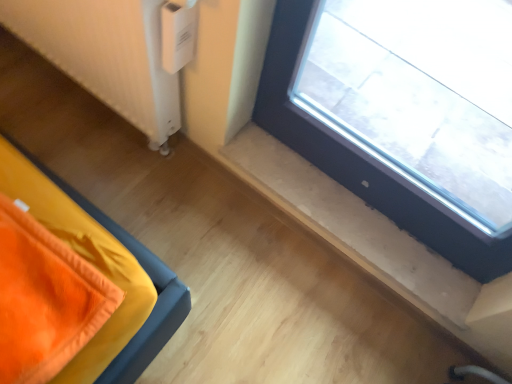
Locate an element on the screen. vacant region under transparent glass window at upper right (from a real-world perspective) is located at coordinates (357, 203).